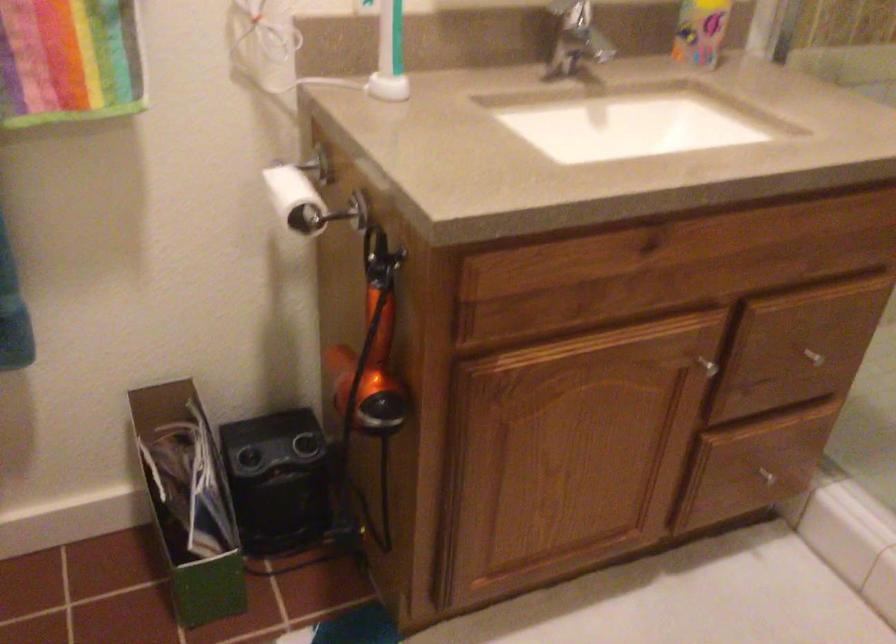
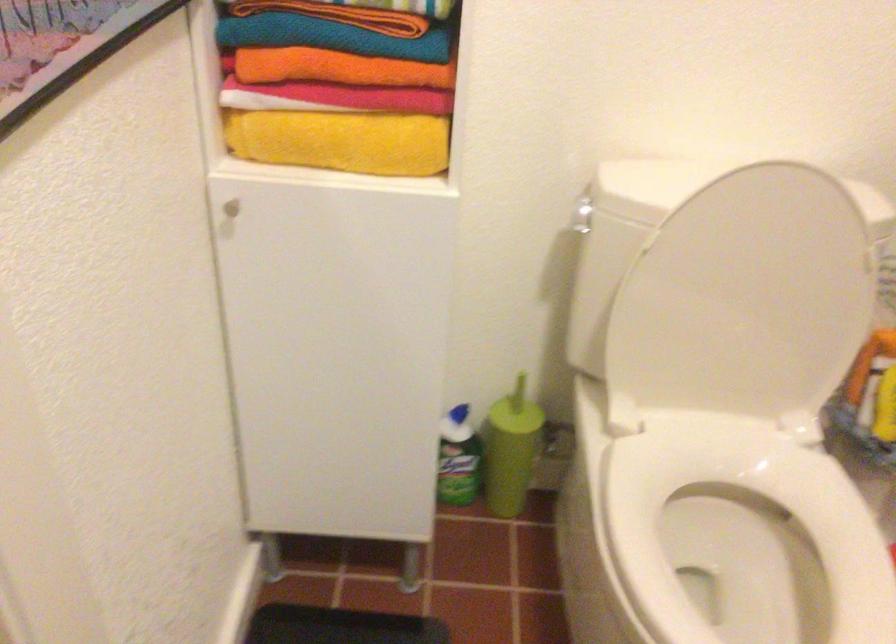
How did the camera likely rotate?

The camera's rotation is toward left-down.